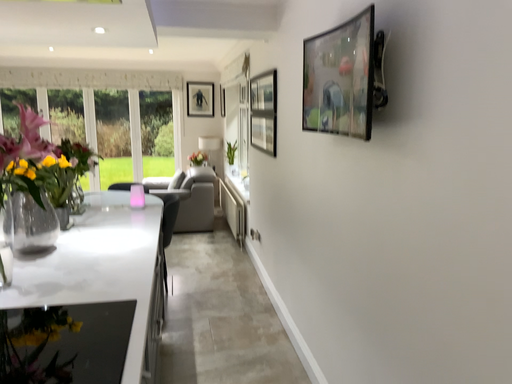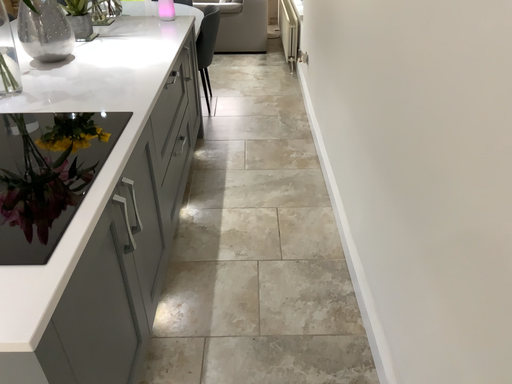
Question: How did the camera likely rotate when shooting the video?

Choices:
 (A) rotated downward
 (B) rotated upward

Answer: (A)